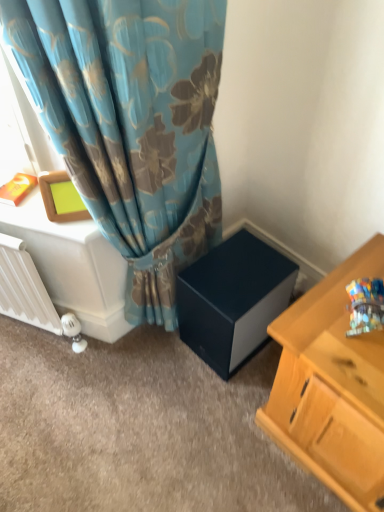
Locate an element on the screen. white matte radiator at lower left is located at coordinates (24, 288).

Identify the location of white glossy table at left. This screenshot has width=384, height=512. (73, 266).

The image size is (384, 512). Find the location of `matte black cube at center`. matte black cube at center is located at coordinates (233, 298).

Considering the sizes of objects white matte radiator at lower left and white glossy table at left in the image provided, who is shorter, white matte radiator at lower left or white glossy table at left?

white glossy table at left is shorter.

How many degrees apart are the facing directions of white matte radiator at lower left and white glossy table at left?

They differ by 0.000134 degrees in their facing directions.

Is white matte radiator at lower left spatially inside white glossy table at left, or outside of it?

white matte radiator at lower left exists outside the volume of white glossy table at left.

Considering the relative sizes of matte black cube at center and white matte radiator at lower left in the image provided, is matte black cube at center wider than white matte radiator at lower left?

Indeed, matte black cube at center has a greater width compared to white matte radiator at lower left.

Which of these two, matte black cube at center or white matte radiator at lower left, stands taller?

white matte radiator at lower left is taller.

Considering the relative positions of matte black cube at center and white matte radiator at lower left in the image provided, is matte black cube at center to the right of white matte radiator at lower left from the viewer's perspective?

Yes.

Does white glossy table at left contain white matte radiator at lower left?

No.

From a real-world perspective, is white glossy table at left positioned above or below white matte radiator at lower left?

white glossy table at left is below white matte radiator at lower left.

Could you tell me if white glossy table at left is turned towards white matte radiator at lower left?

Yes, white glossy table at left is oriented towards white matte radiator at lower left.

Based on their sizes in the image, would you say white glossy table at left is bigger or smaller than white matte radiator at lower left?

Clearly, white glossy table at left is larger in size than white matte radiator at lower left.

From the image's perspective, which one is positioned lower, white glossy table at left or matte black cube at center?

From the image's view, matte black cube at center is below.

Consider the image. Which is behind, white glossy table at left or matte black cube at center?

white glossy table at left.

Is white glossy table at left wider or thinner than matte black cube at center?

Considering their sizes, white glossy table at left looks slimmer than matte black cube at center.

How much distance is there between matte black cube at center and white glossy table at left?

matte black cube at center and white glossy table at left are 34.33 centimeters apart from each other.

Is matte black cube at center wider than white glossy table at left?

Yes, matte black cube at center is wider than white glossy table at left.

Between matte black cube at center and white glossy table at left, which one has larger size?

With larger size is white glossy table at left.

What's the angular difference between matte black cube at center and white glossy table at left's facing directions?

They differ by 27.9 degrees in their facing directions.

Is white matte radiator at lower left facing away from matte black cube at center?

That's not correct — white matte radiator at lower left is not looking away from matte black cube at center.

Is white matte radiator at lower left directly adjacent to matte black cube at center?

white matte radiator at lower left and matte black cube at center are not in contact.

Is white matte radiator at lower left wider or thinner than matte black cube at center?

white matte radiator at lower left is thinner than matte black cube at center.

How many degrees apart are the facing directions of white matte radiator at lower left and matte black cube at center?

The angle between the facing direction of white matte radiator at lower left and the facing direction of matte black cube at center is 27.9 degrees.

Find the location of a particular element. radiator that is on the left side of white glossy table at left is located at coordinates (24, 288).

The image size is (384, 512). What are the coordinates of `radiator that appears in front of the matte black cube at center` in the screenshot? It's located at point(24,288).

Looking at the image, which one is located closer to white glossy table at left, white matte radiator at lower left or matte black cube at center?

white matte radiator at lower left is closer to white glossy table at left.

From the picture: From the image, which object appears to be farther from white matte radiator at lower left, matte black cube at center or white glossy table at left?

matte black cube at center is positioned further to the anchor white matte radiator at lower left.

When comparing their distances from white glossy table at left, does matte black cube at center or white matte radiator at lower left seem further?

matte black cube at center is positioned further to the anchor white glossy table at left.

Looking at the image, which one is located closer to matte black cube at center, white glossy table at left or white matte radiator at lower left?

The object closer to matte black cube at center is white glossy table at left.

Estimate the real-world distances between objects in this image. Which object is further from white matte radiator at lower left, white glossy table at left or matte black cube at center?

matte black cube at center lies further to white matte radiator at lower left than the other object.

From the picture: Which object lies nearer to the anchor point matte black cube at center, white matte radiator at lower left or white glossy table at left?

white glossy table at left is closer to matte black cube at center.

Locate an element on the screen. This screenshot has width=384, height=512. table between white matte radiator at lower left and matte black cube at center is located at coordinates (73, 266).